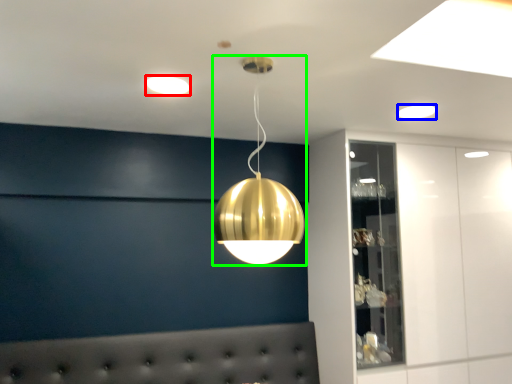
Question: Which object is the farthest from lamp (highlighted by a red box)? Choose among these: lamp (highlighted by a blue box) or lamp (highlighted by a green box).

Choices:
 (A) lamp
 (B) lamp

Answer: (A)